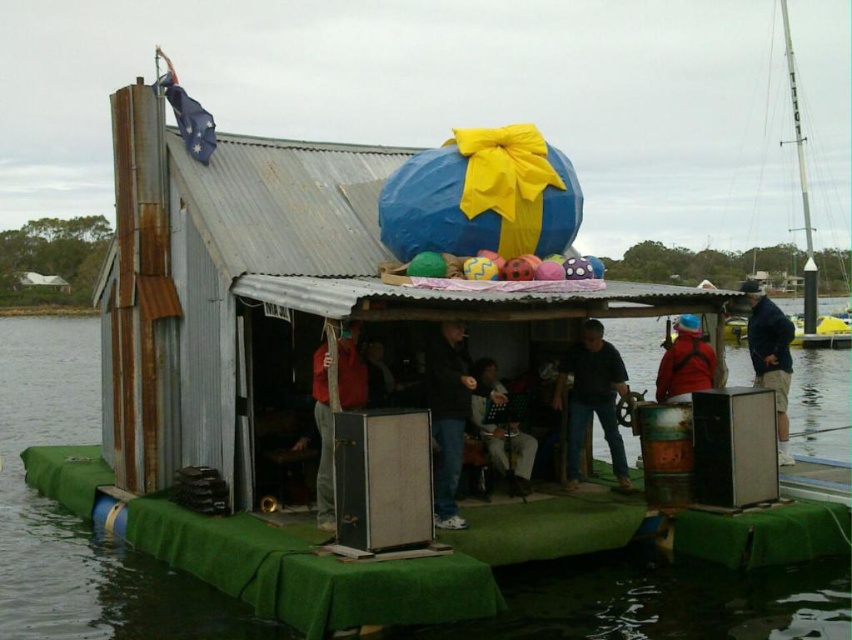
Which is above, green fabric at center or red fleece jacket at center?

green fabric at center is higher up.

Is green fabric at center smaller than red fleece jacket at center?

Incorrect, green fabric at center is not smaller in size than red fleece jacket at center.

Locate an element on the screen. green fabric at center is located at coordinates (76, 518).

Is point (450, 442) in front of point (758, 323)?

That is True.

At what (x,y) coordinates should I click in order to perform the action: click on black matte jacket at center. Please return your answer as a coordinate pair (x, y). Image resolution: width=852 pixels, height=640 pixels. Looking at the image, I should click on (448, 416).

Locate an element on the screen. black matte jacket at center is located at coordinates (448, 416).

Does dark blue shirt at center lie in front of white paper music stand at center?

Yes, dark blue shirt at center is closer to the viewer.

Is dark blue shirt at center smaller than white paper music stand at center?

No, dark blue shirt at center is not smaller than white paper music stand at center.

This screenshot has width=852, height=640. I want to click on dark blue shirt at center, so click(x=591, y=397).